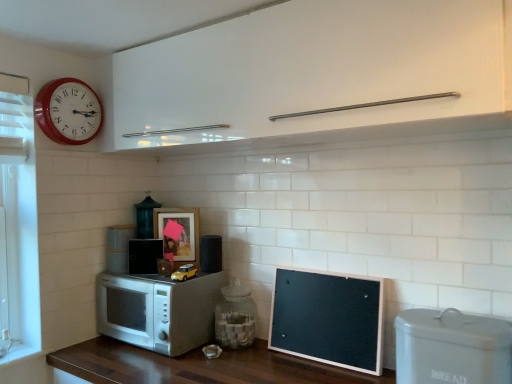
Question: Is black matte speaker at center, the third appliance in the back-to-front sequence, wider or thinner than white matte microwave at lower left, the 2th appliance from the back?

Choices:
 (A) wide
 (B) thin

Answer: (B)

Question: In terms of size, does black matte speaker at center, which is the third appliance in right-to-left order, appear bigger or smaller than white matte microwave at lower left, marked as the first appliance in a left-to-right arrangement?

Choices:
 (A) big
 (B) small

Answer: (B)

Question: Estimate the real-world distances between objects in this image. Which object is farther from the metallic green lantern at center, the 6th appliance viewed from the front?

Choices:
 (A) transparent glass jar at center, marked as the 2th appliance in a right-to-left arrangement
 (B) matte wooden picture frame at center
 (C) white matte microwave at lower left, which is counted as the 6th appliance, starting from the right
 (D) black matte bulletin board at lower right
 (E) white glossy microwave at lower left

Answer: (D)

Question: Based on their relative distances, which object is nearer to the matte wooden picture frame at center?

Choices:
 (A) transparent glass jar at center, the 4th appliance from the back
 (B) white glossy microwave at lower left
 (C) red plastic wall clock at upper left
 (D) black matte bulletin board at lower right
 (E) yellow matte toy car at center, which is the second appliance from front to back

Answer: (E)